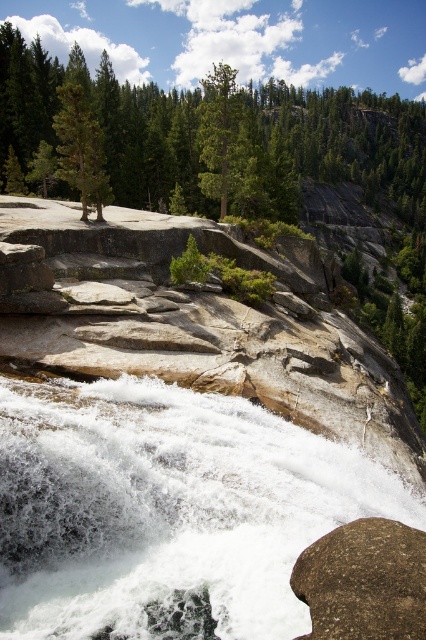
In the scene shown: You are standing at the edge of the waterfall and see the white frothy water at center and the brown rough rock at lower right. Which object is closer to you?

The white frothy water at center is closer to you because the brown rough rock at lower right is behind it.

You are a hiker standing at the base of the waterfall. You notice the white frothy water at center and the green matte tree at upper center. Which object is located higher in the scene?

The green matte tree at upper center is located higher in the scene than the white frothy water at center.

You are a hiker standing at the edge of the waterfall. You notice the white frothy water at center and the brown rough rock at lower right. Which object is wider from your viewpoint?

The white frothy water at center is wider than the brown rough rock at lower right according to the description.